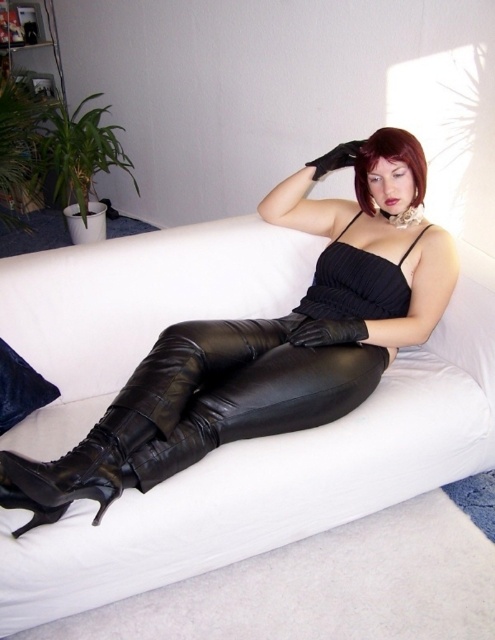
Question: Which of the following is the closest to the observer?

Choices:
 (A) black leather dress at center
 (B) white leather couch at center

Answer: (B)

Question: Is white leather couch at center wider than black leather dress at center?

Choices:
 (A) no
 (B) yes

Answer: (B)

Question: Is white leather couch at center to the left of black leather glove at center from the viewer's perspective?

Choices:
 (A) yes
 (B) no

Answer: (A)

Question: Does black leather dress at center appear on the left side of black leather glove at center?

Choices:
 (A) yes
 (B) no

Answer: (A)

Question: Which object is closer to the camera taking this photo?

Choices:
 (A) black leather glove at center
 (B) black leather dress at center
 (C) white leather couch at center

Answer: (C)

Question: Which of the following is the farthest from the observer?

Choices:
 (A) (345, 317)
 (B) (424, 369)
 (C) (149, 440)

Answer: (B)